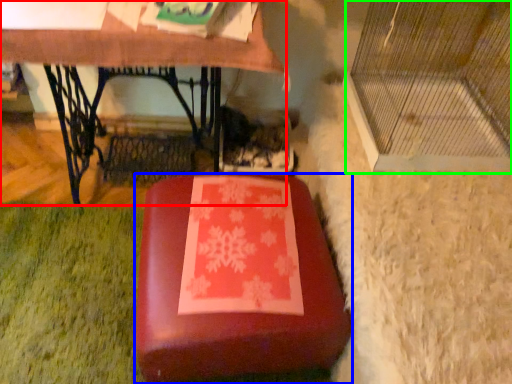
Question: Estimate the real-world distances between objects in this image. Which object is farther from table (highlighted by a red box), furniture (highlighted by a blue box) or glass door (highlighted by a green box)?

Choices:
 (A) furniture
 (B) glass door

Answer: (A)